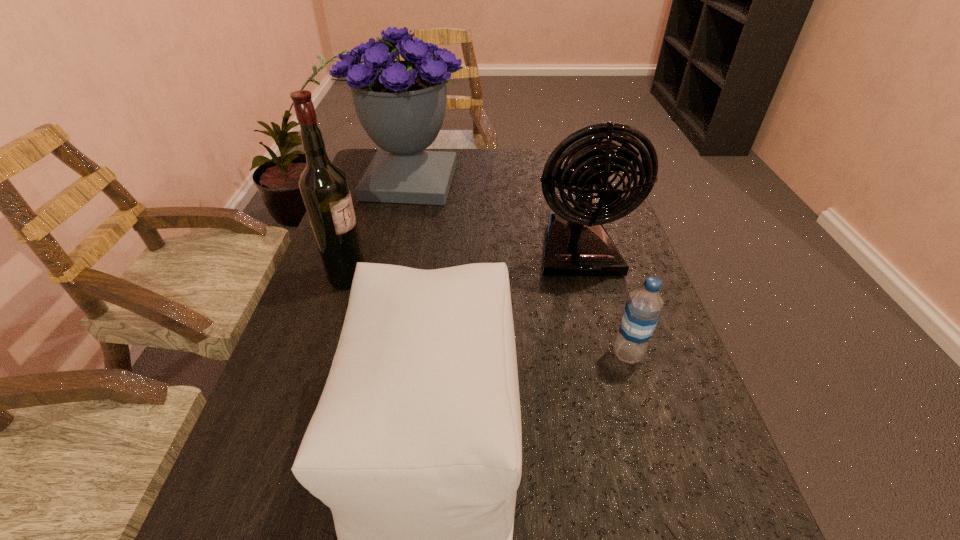
This screenshot has height=540, width=960. What are the coordinates of `object that is at the far edge` in the screenshot? It's located at (401, 104).

The height and width of the screenshot is (540, 960). What are the coordinates of `bouquet that is at the left edge` in the screenshot? It's located at (401, 104).

Identify the location of wine bottle at the left edge. (324, 187).

The image size is (960, 540). In order to click on fan located in the right edge section of the desktop in this screenshot , I will do `click(577, 244)`.

Identify the location of water bottle at the right edge. This screenshot has height=540, width=960. (642, 310).

The width and height of the screenshot is (960, 540). What are the coordinates of `object that is at the far left corner` in the screenshot? It's located at (401, 104).

Image resolution: width=960 pixels, height=540 pixels. Find the location of `vacant space at the far edge`. vacant space at the far edge is located at coordinates (466, 179).

In the image, there is a desktop. Find the location of `vacant space at the left edge`. vacant space at the left edge is located at coordinates (252, 454).

In the image, there is a desktop. Where is `free space at the right edge`? This screenshot has height=540, width=960. free space at the right edge is located at coordinates (692, 389).

You are a GUI agent. You are given a task and a screenshot of the screen. Output one action in this format:
    pyautogui.click(x=<x>, y=<y>)
    Task: Click on the free area in between the farthest object and the fan
    This screenshot has width=960, height=540.
    Given the screenshot: What is the action you would take?
    pyautogui.click(x=494, y=216)